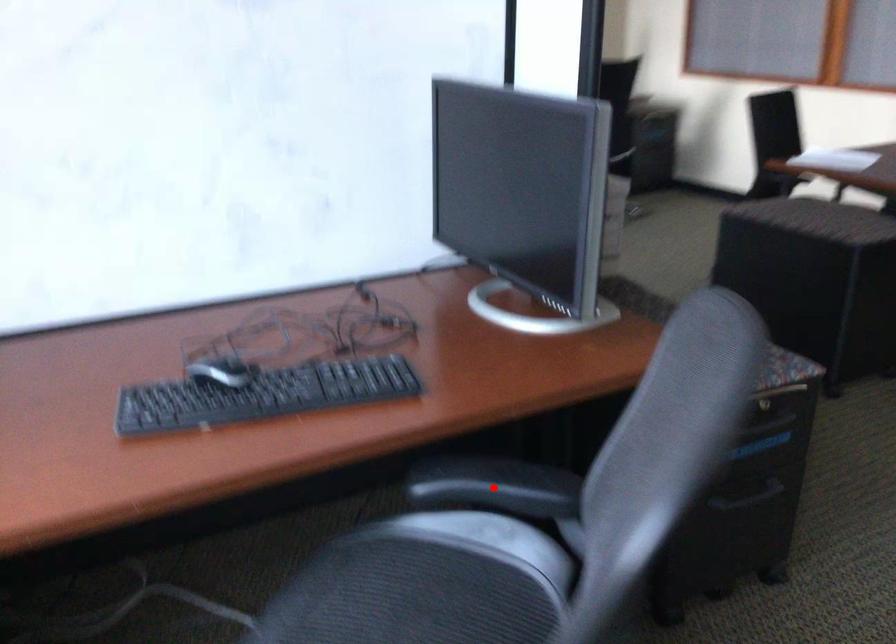
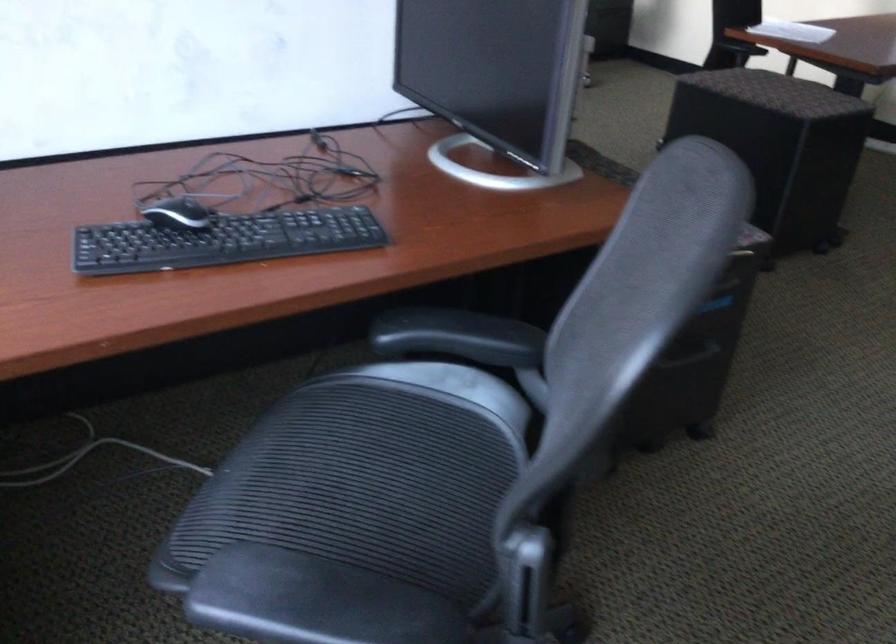
In the second image, find the point that corresponds to the highlighted location in the first image.

(458, 337)